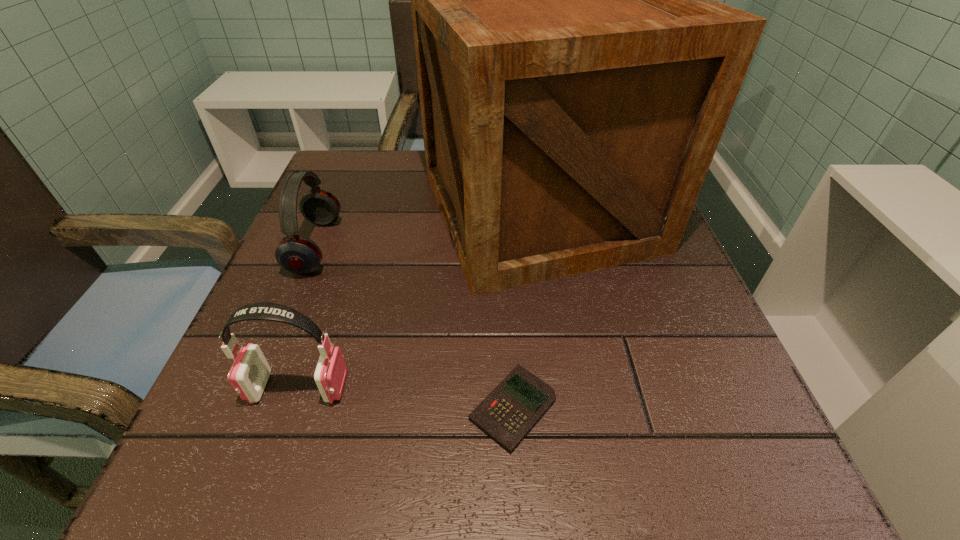
At what (x,y) coordinates should I click in order to perform the action: click on vacant point located between the nearer earphone and the farther earphone. Please return your answer as a coordinate pair (x, y). The height and width of the screenshot is (540, 960). Looking at the image, I should click on (307, 317).

What are the coordinates of `free spot between the nearer earphone and the shortest object` in the screenshot? It's located at (405, 397).

Where is `empty location between the nearer earphone and the farther earphone`? This screenshot has width=960, height=540. empty location between the nearer earphone and the farther earphone is located at coordinates (307, 317).

The image size is (960, 540). I want to click on free space between the tallest object and the shortest object, so click(x=525, y=309).

Image resolution: width=960 pixels, height=540 pixels. Find the location of `vacant space that is in between the box and the nearer earphone`. vacant space that is in between the box and the nearer earphone is located at coordinates (419, 299).

Identify the location of unoccupied area between the shortest object and the nearer earphone. This screenshot has width=960, height=540. (405, 397).

Where is `vacant space that is in between the tallest object and the nearer earphone`? vacant space that is in between the tallest object and the nearer earphone is located at coordinates (419, 299).

Select which object appears as the third closest to the tallest object. Please provide its 2D coordinates. Your answer should be formatted as a tuple, i.e. [(x, y)], where the tuple contains the x and y coordinates of a point satisfying the conditions above.

[(249, 373)]

Locate an element on the screen. object identified as the third closest to the nearer earphone is located at coordinates (297, 254).

Find the location of `free space in the image that satisfies the following two spatial constraints: 1. on the front side of the box; 2. on the ear cups of the farther earphone`. free space in the image that satisfies the following two spatial constraints: 1. on the front side of the box; 2. on the ear cups of the farther earphone is located at coordinates (544, 247).